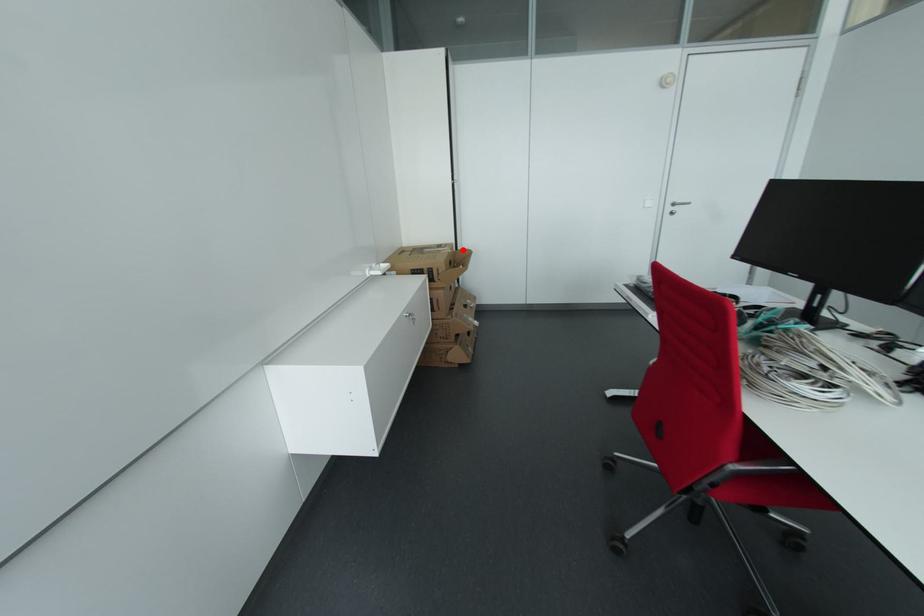
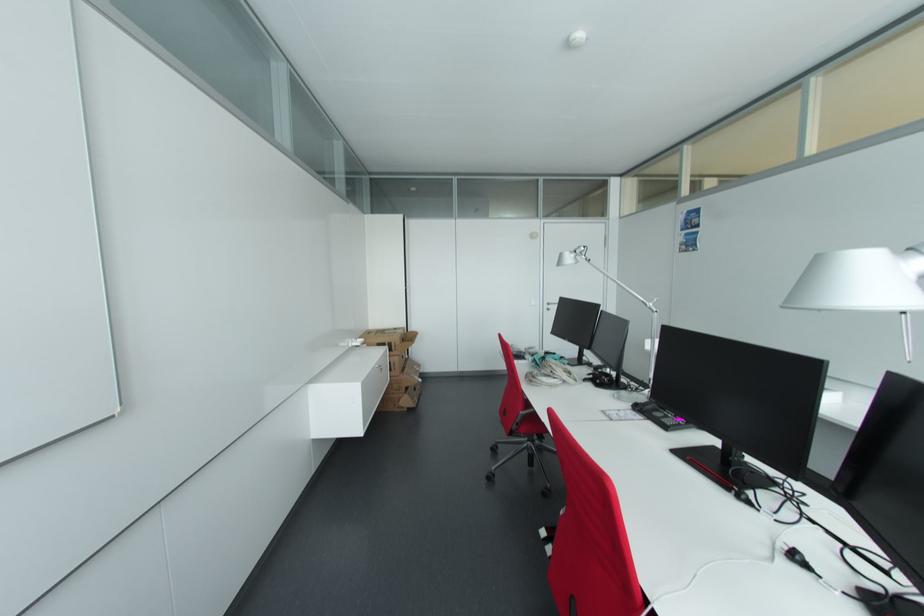
Locate, in the second image, the point that corresponds to the highlighted location in the first image.

(412, 331)